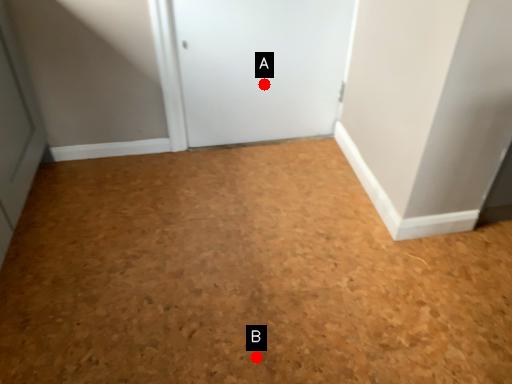
Question: Two points are circled on the image, labeled by A and B beside each circle. Which point appears closest to the camera in this image?

Choices:
 (A) A is closer
 (B) B is closer

Answer: (B)